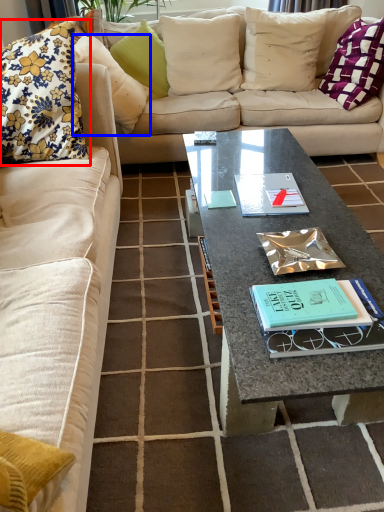
Question: Which object is further to the camera taking this photo, pillow (highlighted by a red box) or pillow (highlighted by a blue box)?

Choices:
 (A) pillow
 (B) pillow

Answer: (B)